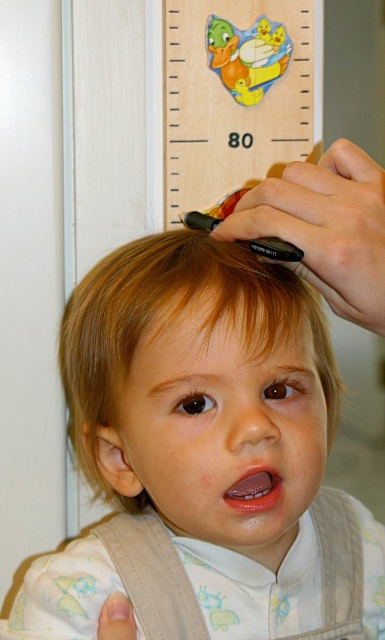
Who is higher up, light brown hair at center or wooden ruler at upper center?

Positioned higher is wooden ruler at upper center.

Who is shorter, light brown hair at center or wooden ruler at upper center?

wooden ruler at upper center is shorter.

Which is in front, point (363, 588) or point (177, 212)?

Point (363, 588)

Where is `light brown hair at center`? This screenshot has height=640, width=385. light brown hair at center is located at coordinates (204, 458).